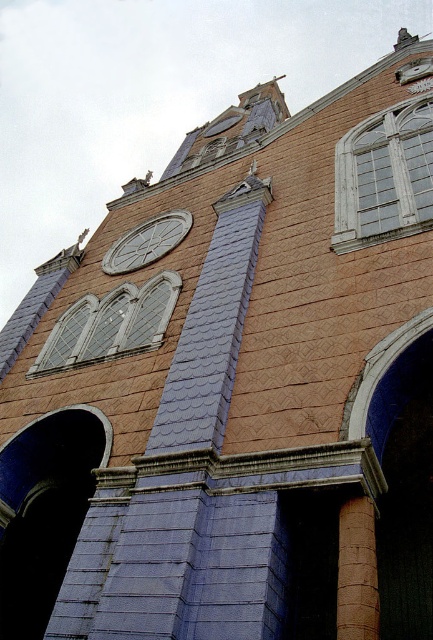
Question: Observing the image, what is the correct spatial positioning of white wooden window at upper right in reference to clear glass windows at center?

Choices:
 (A) above
 (B) below

Answer: (A)

Question: From the image, what is the correct spatial relationship of white wooden window at upper right in relation to matte gray clock at upper center?

Choices:
 (A) right
 (B) left

Answer: (A)

Question: Which is farther from the clear glass windows at center?

Choices:
 (A) matte gray clock at upper center
 (B) white wooden window at upper right

Answer: (B)

Question: Estimate the real-world distances between objects in this image. Which object is closer to the clear glass windows at center?

Choices:
 (A) white wooden window at upper right
 (B) matte gray clock at upper center

Answer: (B)

Question: Can you confirm if white wooden window at upper right is wider than matte gray clock at upper center?

Choices:
 (A) no
 (B) yes

Answer: (B)

Question: Which point is farther to the camera?

Choices:
 (A) white wooden window at upper right
 (B) clear glass windows at center
 (C) matte gray clock at upper center

Answer: (C)